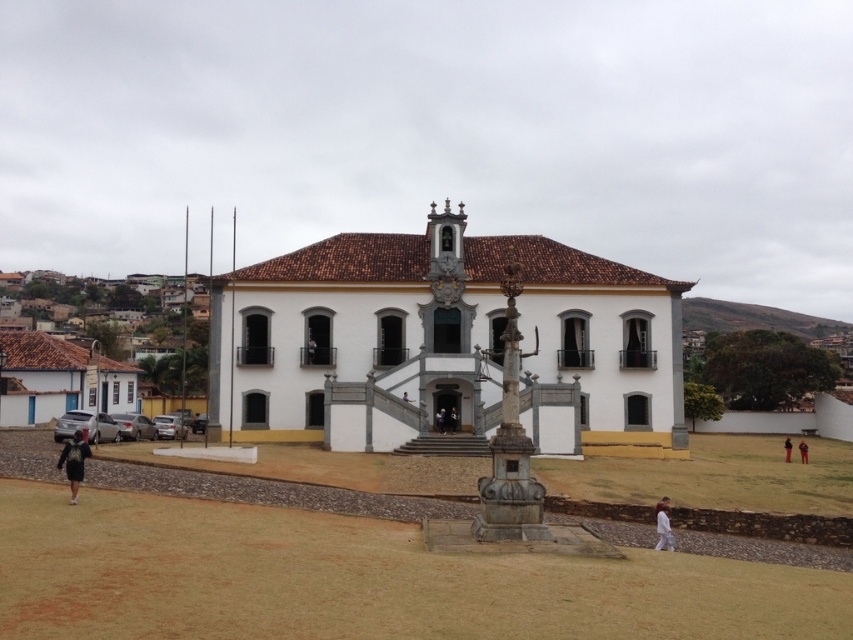
Question: Does dark gray backpack at lower left have a smaller size compared to black fabric person at center?

Choices:
 (A) yes
 (B) no

Answer: (B)

Question: Which object is closer to the camera taking this photo?

Choices:
 (A) white fabric pants at lower right
 (B) white fabric at lower right
 (C) white fabric person at center

Answer: (B)

Question: Which is nearer to the black fabric person at center?

Choices:
 (A) dark gray backpack at lower left
 (B) orange fabric pants at lower right
 (C) white fabric pants at lower right

Answer: (C)

Question: Is black fabric person at center below white fabric pants at lower right?

Choices:
 (A) yes
 (B) no

Answer: (B)

Question: Considering the relative positions of white fabric at lower right and dark gray stone person at center in the image provided, where is white fabric at lower right located with respect to dark gray stone person at center?

Choices:
 (A) above
 (B) below

Answer: (B)

Question: Among these points, which one is farthest from the camera?

Choices:
 (A) (274, 328)
 (B) (801, 460)
 (C) (306, 342)

Answer: (B)